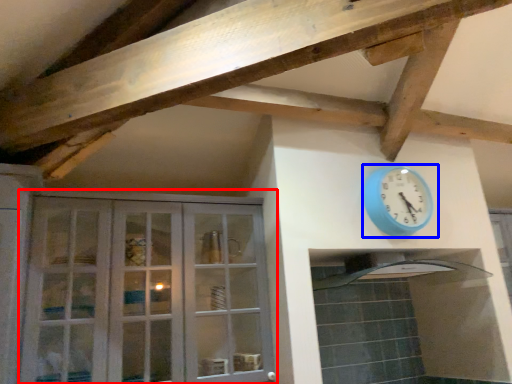
Question: Which of the following is the closest to the observer, cabinetry (highlighted by a red box) or wall clock (highlighted by a blue box)?

Choices:
 (A) cabinetry
 (B) wall clock

Answer: (A)